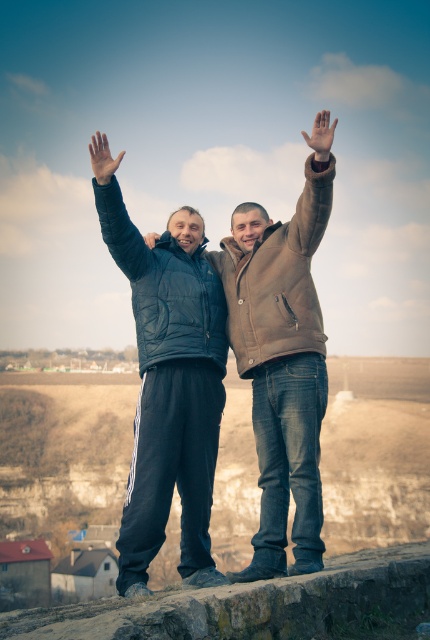
Which is below, matte black jacket at center or brown leather jacket at upper center?

matte black jacket at center is below.

Can you confirm if matte black jacket at center is bigger than brown leather jacket at upper center?

Yes, matte black jacket at center is bigger than brown leather jacket at upper center.

Which is in front, point (278, 560) or point (318, 218)?

Positioned in front is point (278, 560).

Find the location of a particular element. This screenshot has height=640, width=430. matte black jacket at center is located at coordinates (169, 392).

Is matte black hand at upper center to the left of matte brown hand at upper center from the viewer's perspective?

Correct, you'll find matte black hand at upper center to the left of matte brown hand at upper center.

Can you confirm if matte black hand at upper center is bigger than matte brown hand at upper center?

Indeed, matte black hand at upper center has a larger size compared to matte brown hand at upper center.

Is point (98, 179) closer to viewer compared to point (326, 141)?

No, it is not.

The height and width of the screenshot is (640, 430). I want to click on matte black hand at upper center, so click(103, 157).

Locate an element on the screen. matte black jacket at center is located at coordinates (169, 392).

Image resolution: width=430 pixels, height=640 pixels. In order to click on matte black jacket at center in this screenshot , I will do `click(169, 392)`.